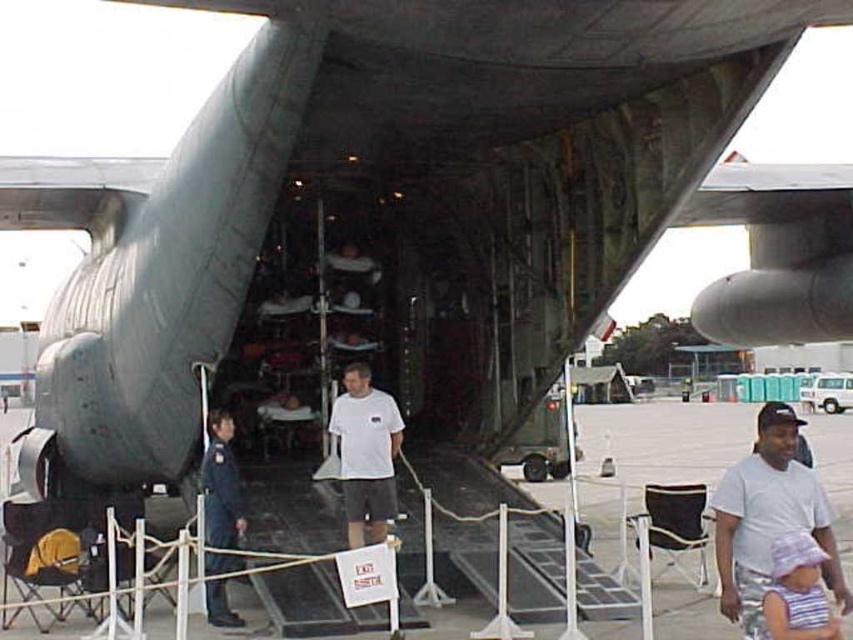
Measure the distance between point (809, 515) and camera.

They are 5.56 meters apart.

Can you confirm if white cotton shirt at center is shorter than striped fabric hat at lower right?

In fact, white cotton shirt at center may be taller than striped fabric hat at lower right.

Between point (787, 483) and point (776, 579), which one is positioned in front?

Point (776, 579)

You are a GUI agent. You are given a task and a screenshot of the screen. Output one action in this format:
    pyautogui.click(x=<x>, y=<y>)
    Task: Click on the white cotton shirt at center
    
    Given the screenshot: What is the action you would take?
    pyautogui.click(x=769, y=518)

Which is above, white cotton shirt at center or blue uniform at center?

white cotton shirt at center is above.

Looking at this image, can you confirm if white cotton shirt at center is taller than blue uniform at center?

No.

Is point (836, 552) behind point (218, 520)?

That is False.

Where is `white cotton shirt at center`? The height and width of the screenshot is (640, 853). white cotton shirt at center is located at coordinates (769, 518).

Between white cotton shirt at center and white matte t-shirt at center, which one appears on the left side from the viewer's perspective?

white matte t-shirt at center

Is white cotton shirt at center below white matte t-shirt at center?

Yes, white cotton shirt at center is below white matte t-shirt at center.

I want to click on white cotton shirt at center, so click(x=769, y=518).